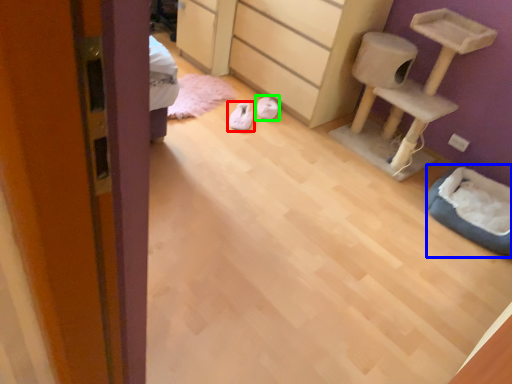
Question: Based on their relative distances, which object is nearer to footwear (highlighted by a red box)? Choose from cat bed (highlighted by a blue box) and footwear (highlighted by a green box).

Choices:
 (A) cat bed
 (B) footwear

Answer: (B)